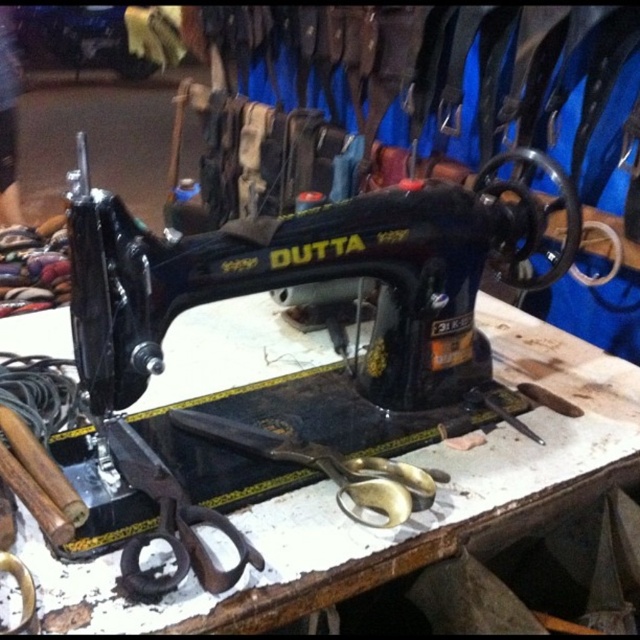
How much distance is there between black matte sewing machine at center and gold metallic scissors at center?

A distance of 16.25 centimeters exists between black matte sewing machine at center and gold metallic scissors at center.

Between black matte sewing machine at center and gold metallic scissors at center, which one appears on the left side from the viewer's perspective?

gold metallic scissors at center

Which is behind, point (468, 243) or point (280, 442)?

Positioned behind is point (468, 243).

This screenshot has width=640, height=640. What are the coordinates of `black matte sewing machine at center` in the screenshot? It's located at (296, 284).

Does black metal scissors at lower left have a greater width compared to gold metallic scissors at center?

In fact, black metal scissors at lower left might be narrower than gold metallic scissors at center.

Who is lower down, black metal scissors at lower left or gold metallic scissors at center?

black metal scissors at lower left is lower down.

Is point (192, 538) farther from viewer compared to point (275, 449)?

No, it is not.

The height and width of the screenshot is (640, 640). I want to click on black metal scissors at lower left, so click(x=170, y=522).

Can you confirm if black matte sewing machine at center is wider than black metal scissors at lower left?

Indeed, black matte sewing machine at center has a greater width compared to black metal scissors at lower left.

Between black matte sewing machine at center and black metal scissors at lower left, which one has more height?

black matte sewing machine at center is taller.

What are the coordinates of `black matte sewing machine at center` in the screenshot? It's located at (296, 284).